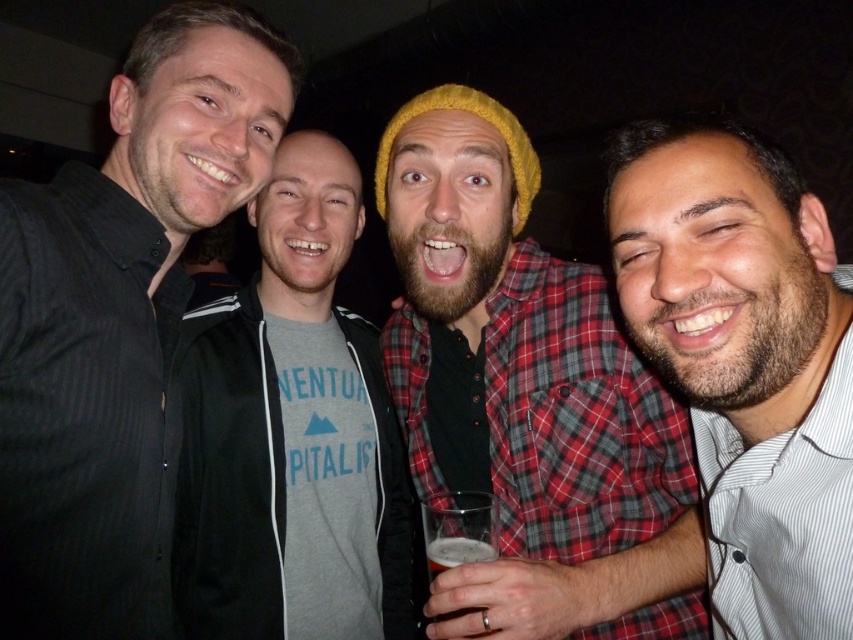
Question: Which point is farther to the camera?

Choices:
 (A) (347, 602)
 (B) (508, 589)
 (C) (463, 545)

Answer: (A)

Question: Is knitted yellow beanie at center below translucent glass beer at center?

Choices:
 (A) yes
 (B) no

Answer: (B)

Question: Is gray zip-up hoodie at center to the right of translucent glass beer at center from the viewer's perspective?

Choices:
 (A) yes
 (B) no

Answer: (B)

Question: Which point is farther to the camera?

Choices:
 (A) black striped shirt at left
 (B) yellow knitted hat at center
 (C) translucent glass beer at center
 (D) gray zip-up hoodie at center

Answer: (D)

Question: Which object is closer to the camera taking this photo?

Choices:
 (A) yellow knitted hat at center
 (B) translucent glass beer at center
 (C) black striped shirt at left

Answer: (C)

Question: Does black striped shirt at left come behind yellow knitted hat at center?

Choices:
 (A) yes
 (B) no

Answer: (B)